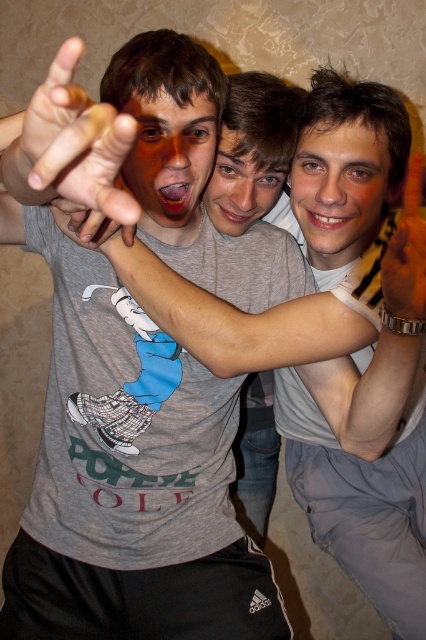
Question: Which object is positioned farthest from the brown leather watch at upper right?

Choices:
 (A) brown leather hand at upper left
 (B) gray matte t-shirt at center

Answer: (B)

Question: Is gray matte t-shirt at center wider than brown leather hand at upper left?

Choices:
 (A) no
 (B) yes

Answer: (A)

Question: Can you confirm if brown leather hand at upper left is smaller than brown leather watch at upper right?

Choices:
 (A) no
 (B) yes

Answer: (A)

Question: Based on their relative distances, which object is farther from the brown leather watch at upper right?

Choices:
 (A) gray matte t-shirt at center
 (B) brown leather hand at upper left

Answer: (A)

Question: Which object appears closest to the camera in this image?

Choices:
 (A) brown leather watch at upper right
 (B) brown leather hand at upper left

Answer: (B)

Question: Does gray matte t-shirt at center lie in front of brown leather hand at upper left?

Choices:
 (A) no
 (B) yes

Answer: (A)